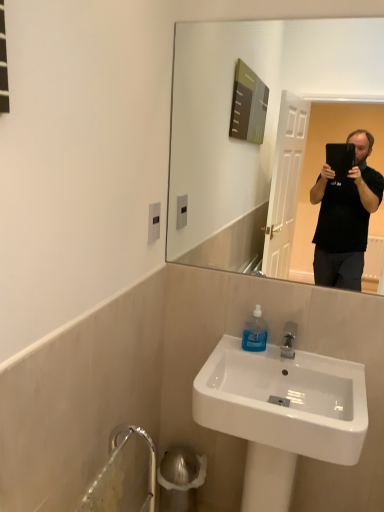
Question: Considering the relative sizes of white glossy sink at lower center and transparent plastic bottle at sink in the image provided, is white glossy sink at lower center wider than transparent plastic bottle at sink?

Choices:
 (A) no
 (B) yes

Answer: (B)

Question: From the image's perspective, is white glossy sink at lower center over transparent plastic bottle at sink?

Choices:
 (A) no
 (B) yes

Answer: (A)

Question: Is white glossy sink at lower center outside of transparent plastic bottle at sink?

Choices:
 (A) no
 (B) yes

Answer: (B)

Question: Is white glossy sink at lower center beside transparent plastic bottle at sink?

Choices:
 (A) no
 (B) yes

Answer: (A)

Question: Can you confirm if white glossy sink at lower center is thinner than transparent plastic bottle at sink?

Choices:
 (A) no
 (B) yes

Answer: (A)

Question: Can you confirm if white glossy sink at lower center is taller than transparent plastic bottle at sink?

Choices:
 (A) no
 (B) yes

Answer: (B)

Question: Is transparent plastic bottle at sink next to white glossy sink at lower center and touching it?

Choices:
 (A) no
 (B) yes

Answer: (A)

Question: Are transparent plastic bottle at sink and white glossy sink at lower center far apart?

Choices:
 (A) yes
 (B) no

Answer: (B)

Question: Can we say transparent plastic bottle at sink lies outside white glossy sink at lower center?

Choices:
 (A) yes
 (B) no

Answer: (B)

Question: Is transparent plastic bottle at sink taller than white glossy sink at lower center?

Choices:
 (A) no
 (B) yes

Answer: (A)

Question: Considering the relative positions of transparent plastic bottle at sink and white glossy sink at lower center in the image provided, is transparent plastic bottle at sink to the left of white glossy sink at lower center from the viewer's perspective?

Choices:
 (A) no
 (B) yes

Answer: (B)

Question: From the image's perspective, is transparent plastic bottle at sink beneath white glossy sink at lower center?

Choices:
 (A) no
 (B) yes

Answer: (A)

Question: Looking at their shapes, would you say white glossy sink at lower center is wider or thinner than transparent plastic bottle at sink?

Choices:
 (A) wide
 (B) thin

Answer: (A)